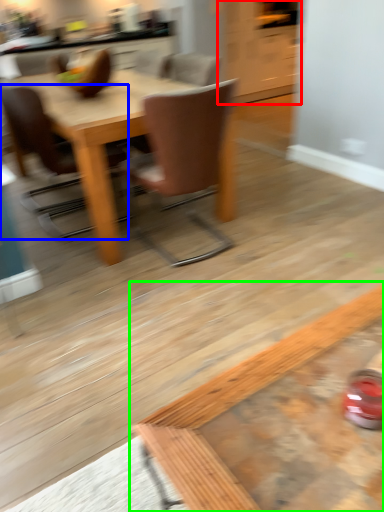
Question: Which is nearer to the cabinetry (highlighted by a red box)? chair (highlighted by a blue box) or coffee table (highlighted by a green box).

Choices:
 (A) chair
 (B) coffee table

Answer: (A)